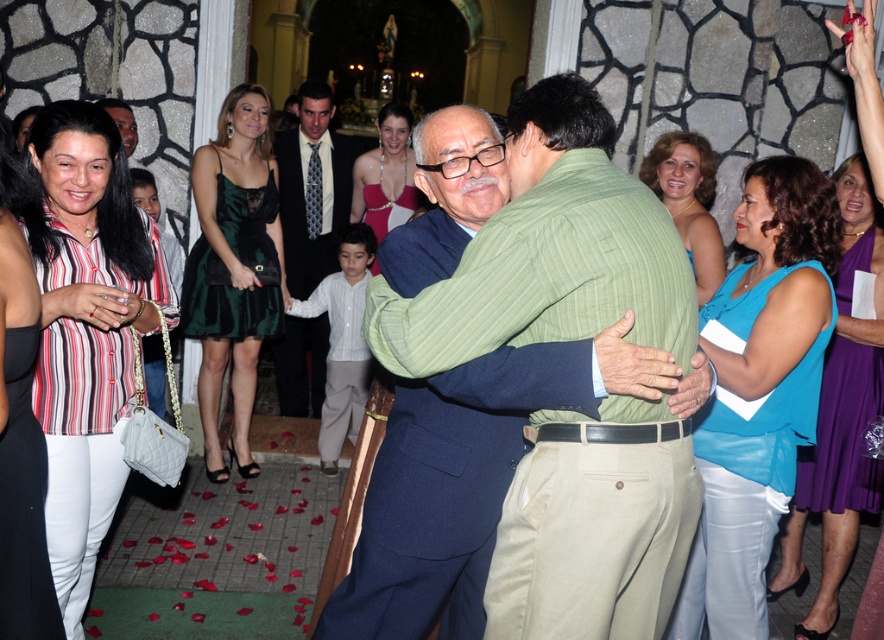
Question: Observing the image, what is the correct spatial positioning of striped cotton blouse at left in reference to gold sequined dress at upper right?

Choices:
 (A) left
 (B) right

Answer: (A)

Question: In this image, where is green satin dress at center located relative to purple satin dress at center?

Choices:
 (A) right
 (B) left

Answer: (B)

Question: Which point is closer to the camera taking this photo?

Choices:
 (A) (366, 205)
 (B) (65, 586)

Answer: (B)

Question: Which point appears farthest from the camera in this image?

Choices:
 (A) (565, 355)
 (B) (275, 332)
 (C) (669, 136)

Answer: (B)

Question: Is blue fabric top at center below purple satin dress at center?

Choices:
 (A) no
 (B) yes

Answer: (A)

Question: Which object appears closest to the camera in this image?

Choices:
 (A) purple satin dress at center
 (B) green striped shirt at center
 (C) gold sequined dress at upper right

Answer: (B)